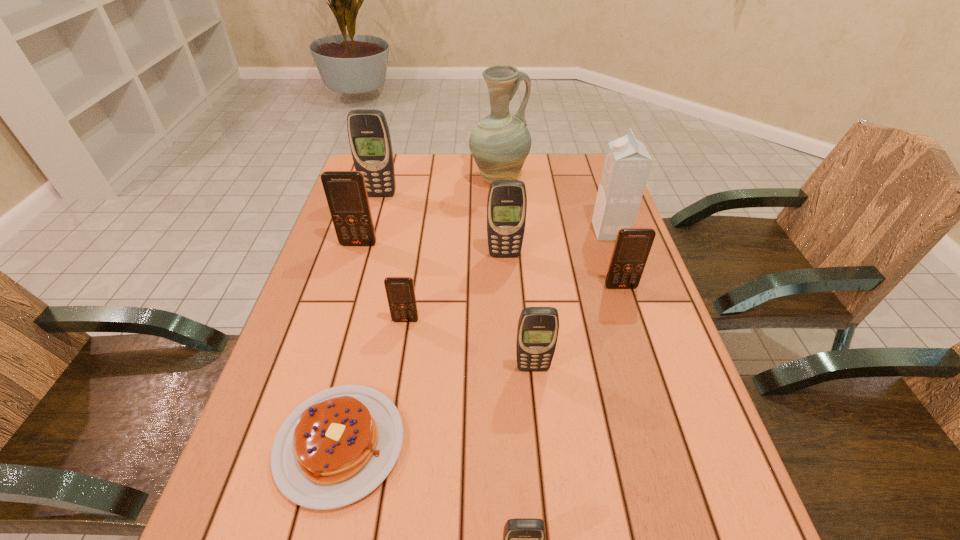
The image size is (960, 540). Find the location of `free spot that satisfies the following two spatial constraints: 1. on the front label of the carton; 2. on the screen of the third nearest gray cellular telephone`. free spot that satisfies the following two spatial constraints: 1. on the front label of the carton; 2. on the screen of the third nearest gray cellular telephone is located at coordinates (618, 255).

The height and width of the screenshot is (540, 960). I want to click on free space that satisfies the following two spatial constraints: 1. on the front label of the carton; 2. on the screen of the second smallest gray cellular telephone, so click(x=657, y=368).